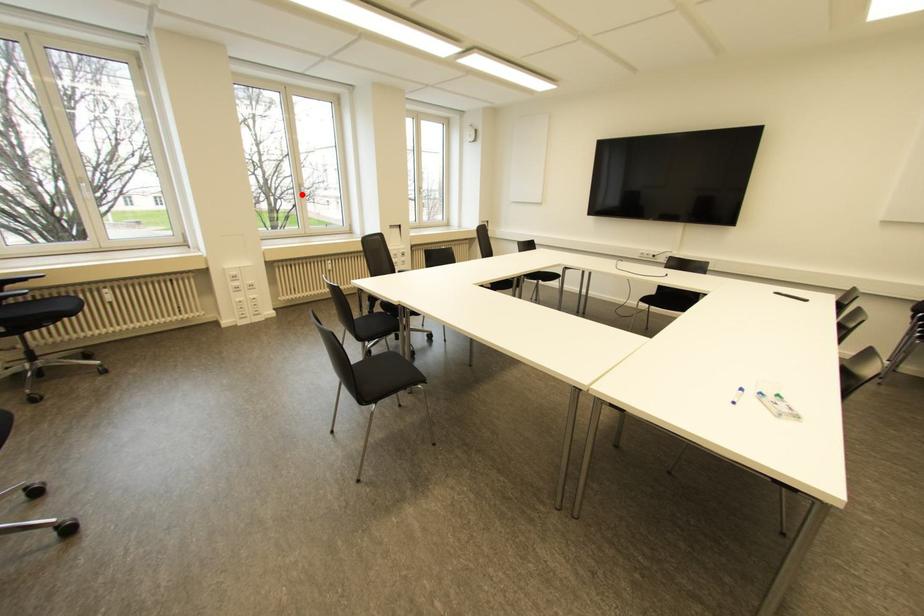
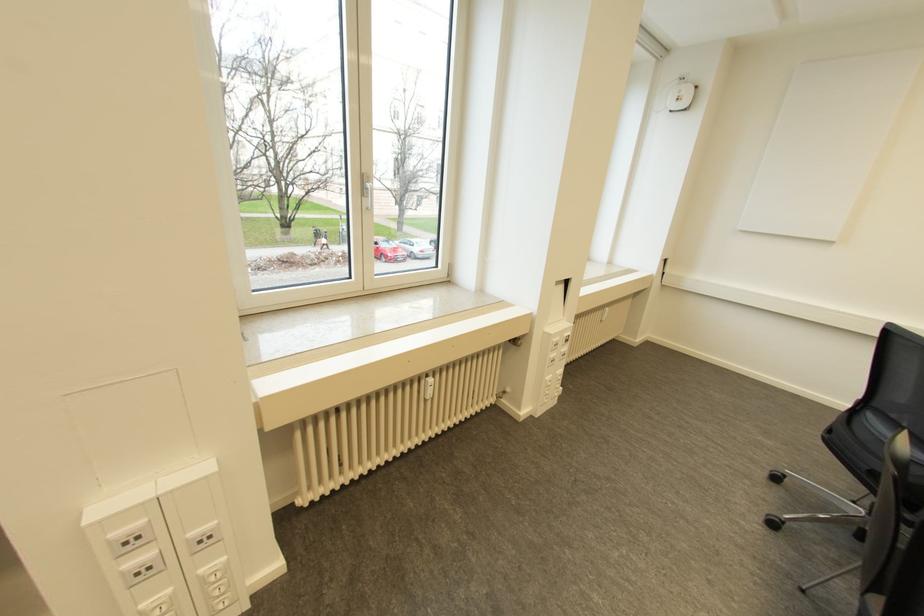
Find the pixel in the second image that matches the highlighted location in the first image.

(366, 201)